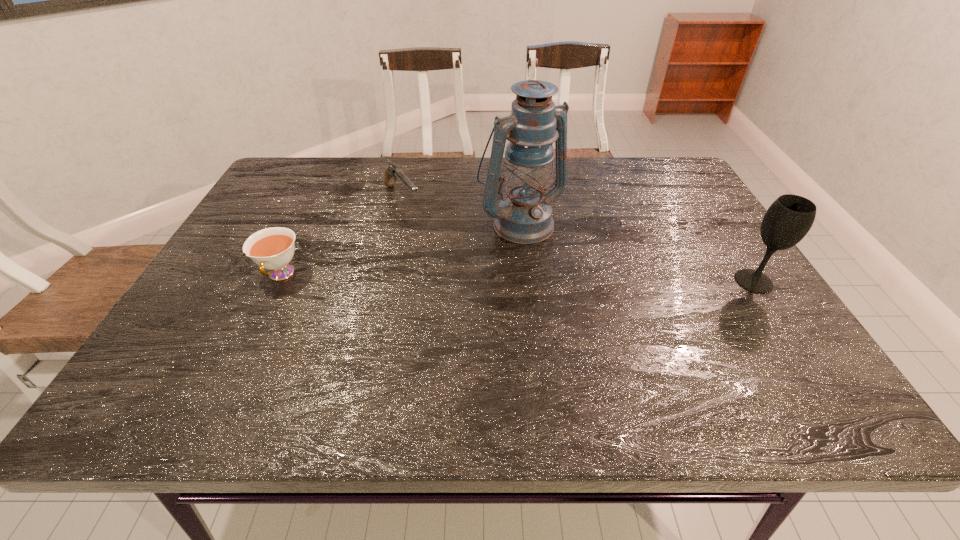
Locate an element on the screen. the leftmost object is located at coordinates point(273,248).

I want to click on the rightmost object, so click(x=790, y=217).

I want to click on wineglass, so click(790, 217).

This screenshot has width=960, height=540. In order to click on the tallest object in this screenshot , I will do `click(525, 216)`.

This screenshot has width=960, height=540. In order to click on the second object from right to left in this screenshot , I will do (x=525, y=216).

In order to click on gun in this screenshot , I will do `click(392, 172)`.

Locate an element on the screen. Image resolution: width=960 pixels, height=540 pixels. vacant space located on the side of the teacup with the handle is located at coordinates (246, 347).

The height and width of the screenshot is (540, 960). Identify the location of vacant space located on the back of the third shortest object. pos(694,191).

Identify the location of free space located on the front-facing side of the lantern. The width and height of the screenshot is (960, 540). (571, 269).

What are the coordinates of `vacant region located 0.360m on the front-facing side of the lantern` in the screenshot? It's located at (640, 340).